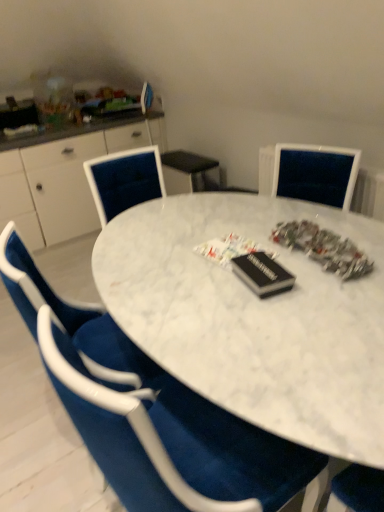
Question: Is white glossy cabinet at left in front of or behind white marble table at center in the image?

Choices:
 (A) front
 (B) behind

Answer: (B)

Question: From their relative heights in the image, would you say white glossy cabinet at left is taller or shorter than white marble table at center?

Choices:
 (A) short
 (B) tall

Answer: (B)

Question: Which of these objects is positioned farthest from the white marble table at center?

Choices:
 (A) white glossy cabinet at left
 (B) velvet blue chair at center

Answer: (A)

Question: Which of these objects is positioned farthest from the white glossy cabinet at left?

Choices:
 (A) white marble table at center
 (B) velvet blue chair at center

Answer: (B)